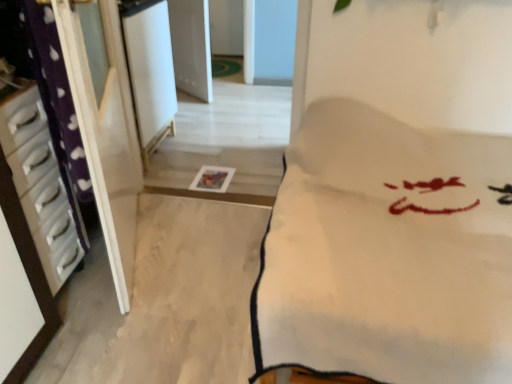
Identify the location of free space in front of white glossy drawer at left, which ranks as the 2th furniture in right-to-left order. 75,336.